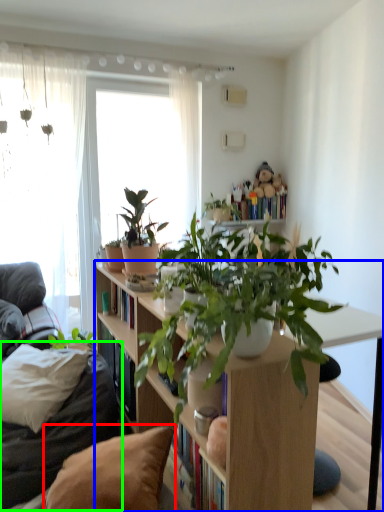
Question: Which object is the farthest from pillow (highlighted by a red box)? Choose among these: bookcase (highlighted by a blue box) or couch (highlighted by a green box).

Choices:
 (A) bookcase
 (B) couch

Answer: (B)